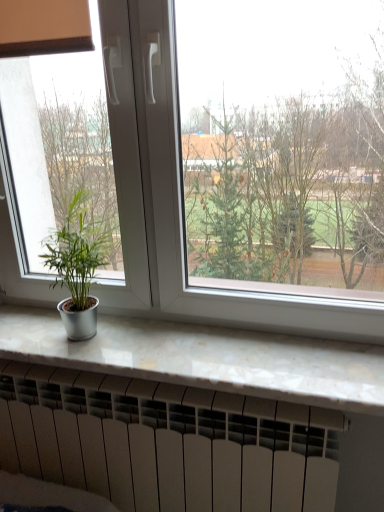
At what (x,y) coordinates should I click in order to perform the action: click on free region on the left part of green matte plant at left. Please return your answer as a coordinate pair (x, y). The width and height of the screenshot is (384, 512). Looking at the image, I should click on (33, 336).